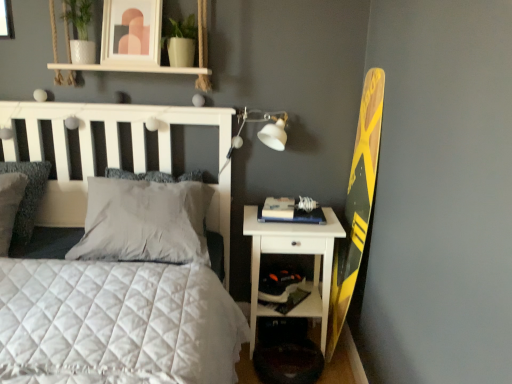
Question: Are white quilted bed at center and gray soft pillow at center, marked as the second pillow in a right-to-left arrangement, far apart?

Choices:
 (A) no
 (B) yes

Answer: (A)

Question: Is white quilted bed at center in contact with gray soft pillow at center, which is the 2th pillow in left-to-right order?

Choices:
 (A) no
 (B) yes

Answer: (A)

Question: From the image's perspective, would you say white quilted bed at center is shown under gray soft pillow at center, which is the 2th pillow in left-to-right order?

Choices:
 (A) no
 (B) yes

Answer: (B)

Question: Considering the relative sizes of white quilted bed at center and gray soft pillow at center, marked as the second pillow in a right-to-left arrangement, in the image provided, is white quilted bed at center taller than gray soft pillow at center, marked as the second pillow in a right-to-left arrangement,?

Choices:
 (A) no
 (B) yes

Answer: (B)

Question: Is white quilted bed at center surrounding gray soft pillow at center, marked as the second pillow in a right-to-left arrangement?

Choices:
 (A) yes
 (B) no

Answer: (A)

Question: Considering the relative positions of white quilted bed at center and gray soft pillow at center, marked as the second pillow in a right-to-left arrangement, in the image provided, is white quilted bed at center to the right of gray soft pillow at center, marked as the second pillow in a right-to-left arrangement, from the viewer's perspective?

Choices:
 (A) no
 (B) yes

Answer: (A)

Question: Are hardcover book at right and gray soft pillow at center, which is the 2th pillow in left-to-right order, located far from each other?

Choices:
 (A) yes
 (B) no

Answer: (B)

Question: Is hardcover book at right positioned behind gray soft pillow at center, which is the 2th pillow in left-to-right order?

Choices:
 (A) no
 (B) yes

Answer: (B)

Question: From the image's perspective, is hardcover book at right on gray soft pillow at center, which is the 2th pillow in left-to-right order?

Choices:
 (A) no
 (B) yes

Answer: (A)

Question: Would you say hardcover book at right is outside gray soft pillow at center, marked as the second pillow in a right-to-left arrangement?

Choices:
 (A) no
 (B) yes

Answer: (B)

Question: Is hardcover book at right smaller than gray soft pillow at center, which is the 2th pillow in left-to-right order?

Choices:
 (A) yes
 (B) no

Answer: (A)

Question: From the image's perspective, would you say hardcover book at right is shown under gray soft pillow at center, which is the 2th pillow in left-to-right order?

Choices:
 (A) no
 (B) yes

Answer: (B)

Question: Is white soft pillow at center, the 3th pillow in the left-to-right sequence, located outside matte white picture frame at upper center?

Choices:
 (A) no
 (B) yes

Answer: (B)